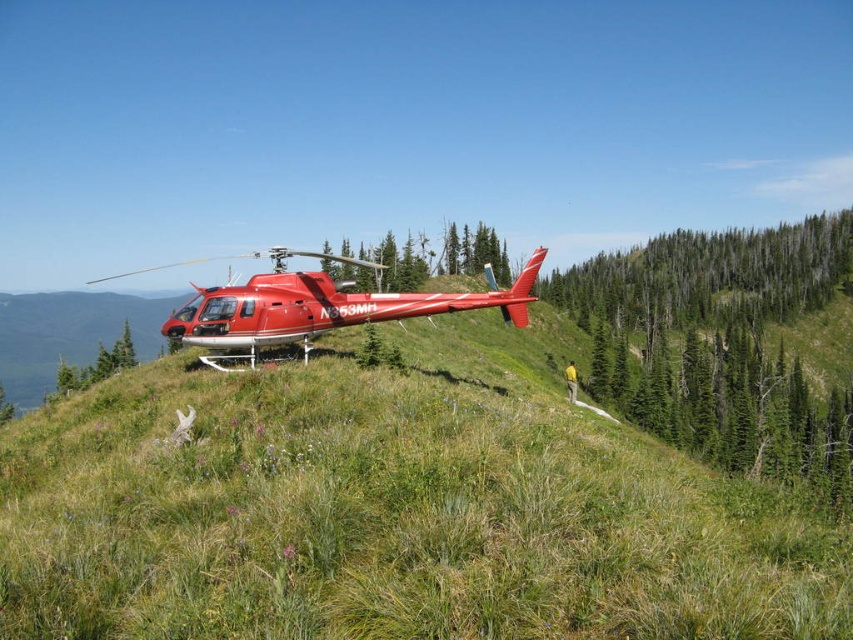
Question: In this image, where is shiny red helicopter at center located relative to green textured tree at center?

Choices:
 (A) left
 (B) right

Answer: (A)

Question: Where is shiny red helicopter at center located in relation to green textured tree at center in the image?

Choices:
 (A) right
 (B) left

Answer: (B)

Question: Which object appears farthest from the camera in this image?

Choices:
 (A) green textured tree at center
 (B) shiny red helicopter at center

Answer: (A)

Question: Does shiny red helicopter at center have a greater width compared to green textured tree at center?

Choices:
 (A) yes
 (B) no

Answer: (A)